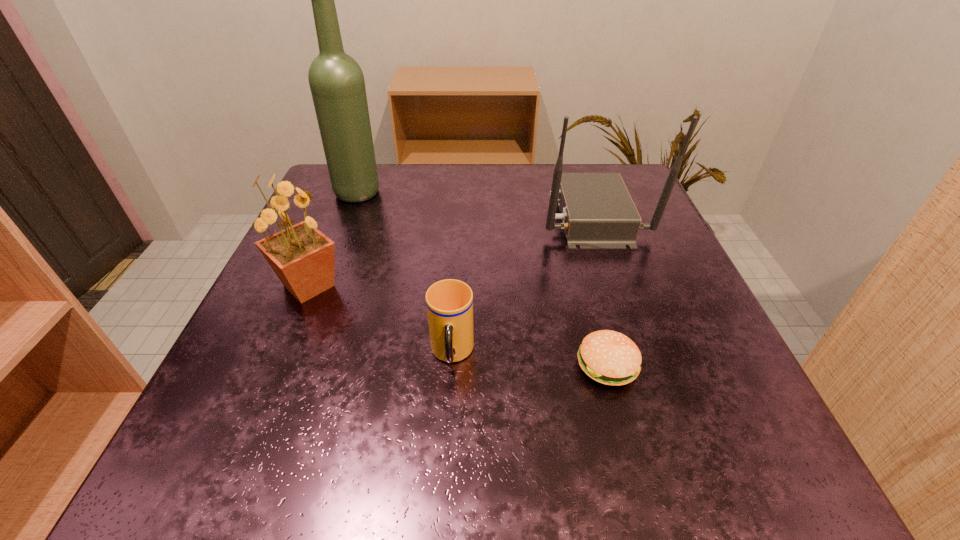
Identify the location of object located in the far right corner section of the desktop. Image resolution: width=960 pixels, height=540 pixels. (597, 212).

In the image, there is a desktop. Where is `vacant area at the far edge`? Image resolution: width=960 pixels, height=540 pixels. vacant area at the far edge is located at coordinates (427, 208).

In the image, there is a desktop. In order to click on vacant space at the near edge in this screenshot , I will do `click(517, 430)`.

Locate an element on the screen. vacant space at the left edge of the desktop is located at coordinates (275, 304).

In order to click on free space at the right edge of the desktop in this screenshot , I will do `click(646, 266)`.

The image size is (960, 540). In order to click on vacant space at the near left corner of the desktop in this screenshot , I will do `click(243, 469)`.

The width and height of the screenshot is (960, 540). Find the location of `free region at the near right corner`. free region at the near right corner is located at coordinates (727, 473).

The image size is (960, 540). Find the location of `free space between the third object from left to right and the wine bottle`. free space between the third object from left to right and the wine bottle is located at coordinates (405, 273).

Find the location of a particular element. Image resolution: width=960 pixels, height=540 pixels. vacant area between the shortest object and the third object from right to left is located at coordinates (530, 360).

Image resolution: width=960 pixels, height=540 pixels. Find the location of `free space between the sunflower and the third object from right to left`. free space between the sunflower and the third object from right to left is located at coordinates (380, 320).